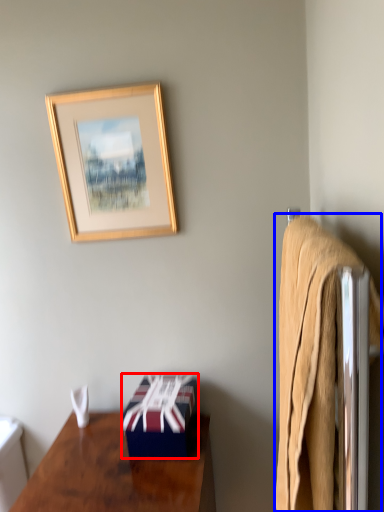
Question: Which object appears closest to the camera in this image, box (highlighted by a red box) or bath towel (highlighted by a blue box)?

Choices:
 (A) box
 (B) bath towel

Answer: (B)